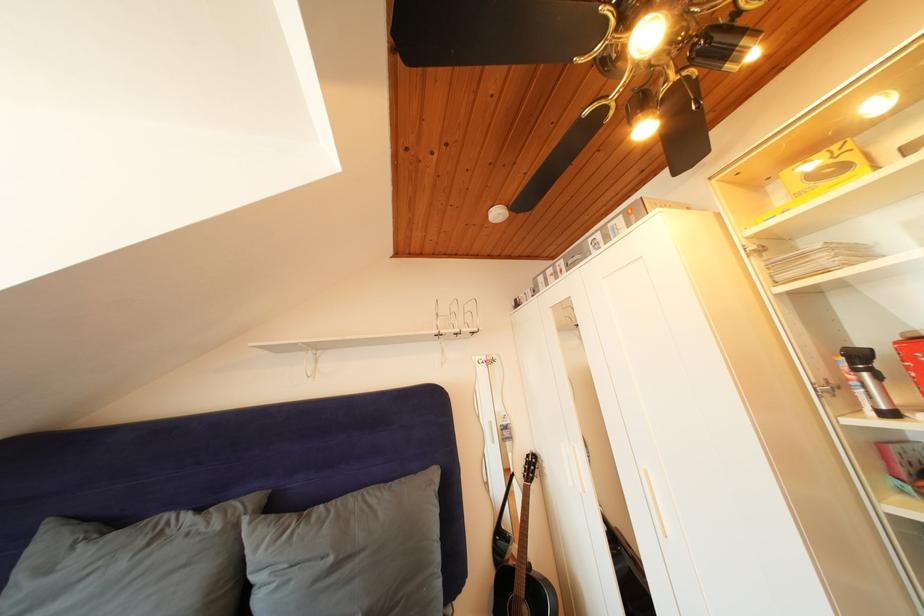
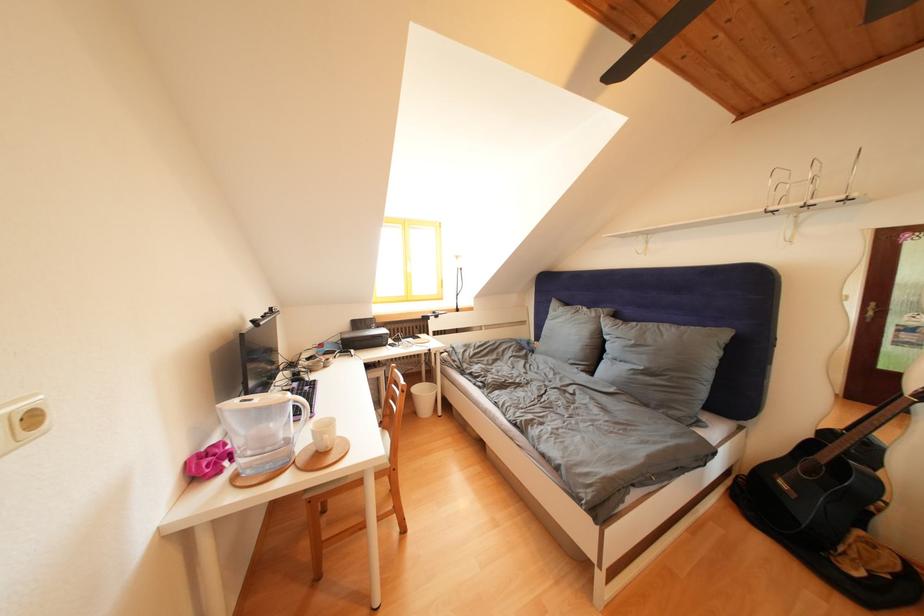
In the second image, find the point that corresponds to the point at 122,528 in the first image.

(575, 310)